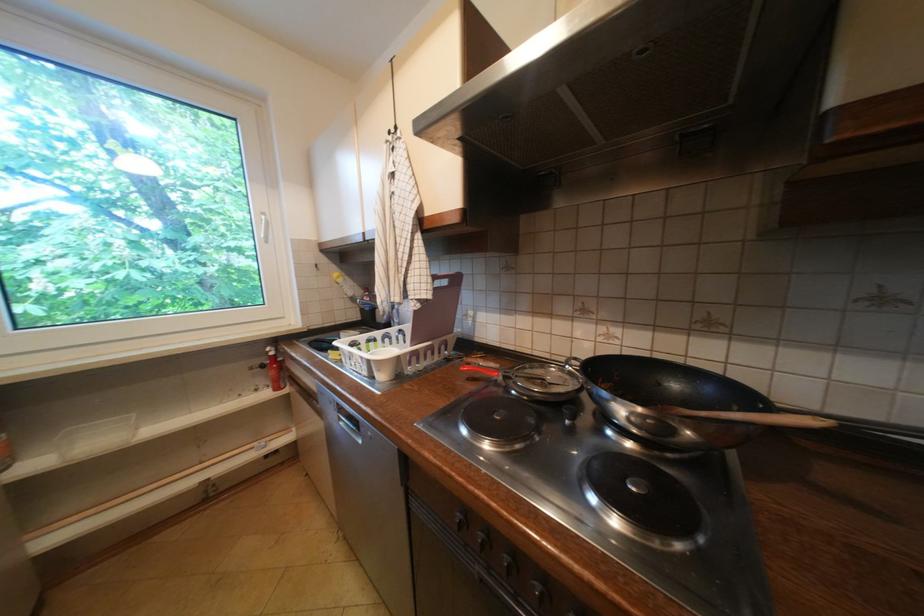
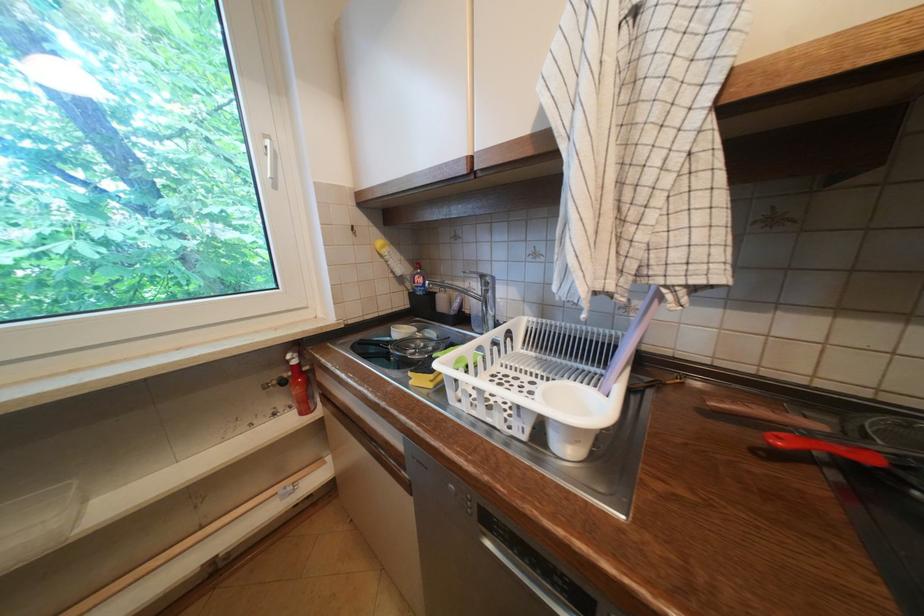
Where in the second image is the point corresponding to [387,371] from the first image?

(586, 443)